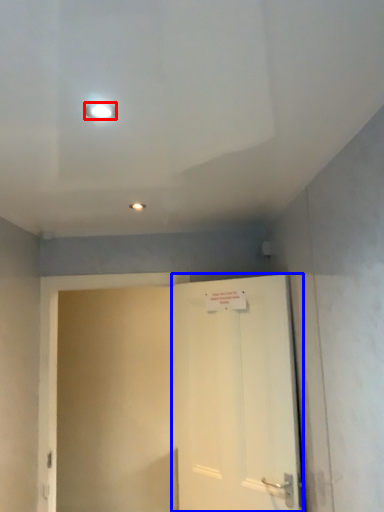
Question: Which of the following is the farthest to the observer, lighting (highlighted by a red box) or door (highlighted by a blue box)?

Choices:
 (A) lighting
 (B) door

Answer: (B)